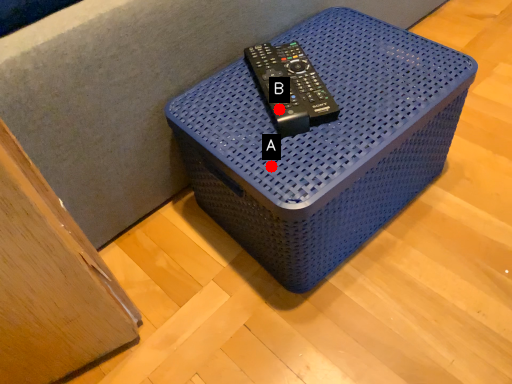
Question: Two points are circled on the image, labeled by A and B beside each circle. Which point appears farthest from the camera in this image?

Choices:
 (A) A is further
 (B) B is further

Answer: (B)